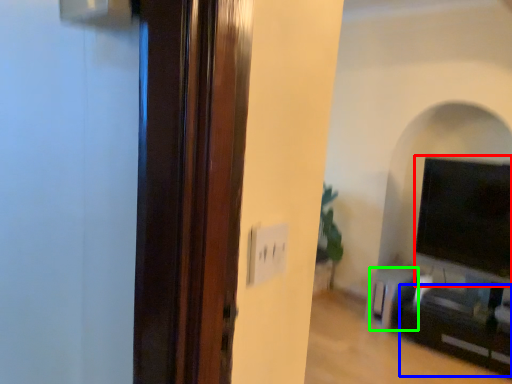
Question: Considering the real-world distances, which object is farthest from wide (highlighted by a red box)? entertainment center (highlighted by a blue box) or furniture (highlighted by a green box)?

Choices:
 (A) entertainment center
 (B) furniture

Answer: (A)